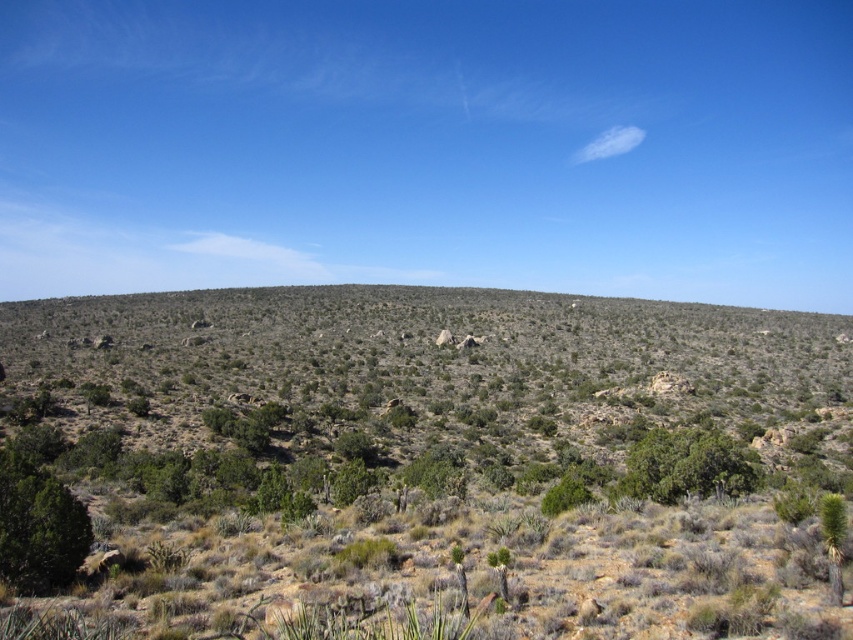
Does green leafy bush at center have a greater width compared to green leafy plant at lower right?

Indeed, green leafy bush at center has a greater width compared to green leafy plant at lower right.

Can you confirm if green leafy bush at center is positioned to the right of green leafy plant at lower right?

Incorrect, green leafy bush at center is not on the right side of green leafy plant at lower right.

Find the location of a particular element. green leafy bush at center is located at coordinates (437, 472).

How far apart are green matte tree at lower left and green leafy plant at lower right?

17.63 meters

Which is in front, point (21, 540) or point (828, 572)?

Point (828, 572) is more forward.

This screenshot has width=853, height=640. In order to click on green matte tree at lower left in this screenshot , I will do `click(38, 525)`.

Who is positioned more to the right, green leafy shrub at lower right or green leafy plant at lower right?

From the viewer's perspective, green leafy shrub at lower right appears more on the right side.

Is green leafy shrub at lower right to the right of green leafy plant at lower right from the viewer's perspective?

Correct, you'll find green leafy shrub at lower right to the right of green leafy plant at lower right.

Is point (642, 486) more distant than point (834, 522)?

Yes.

I want to click on green leafy shrub at lower right, so click(x=683, y=467).